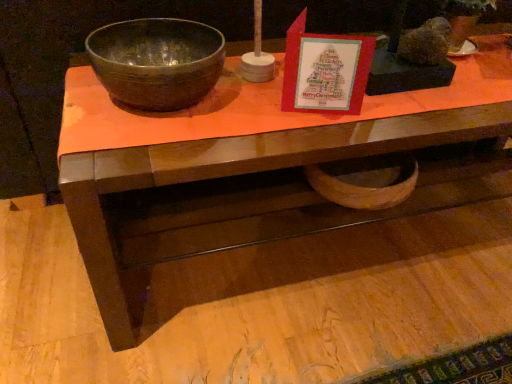
Question: Is matte brown bowl at left to the left of wooden desk at center from the viewer's perspective?

Choices:
 (A) no
 (B) yes

Answer: (B)

Question: From the image's perspective, is matte brown bowl at left under wooden desk at center?

Choices:
 (A) no
 (B) yes

Answer: (A)

Question: Is there a large distance between matte brown bowl at left and wooden desk at center?

Choices:
 (A) yes
 (B) no

Answer: (B)

Question: Considering the relative positions of matte brown bowl at left and wooden desk at center in the image provided, is matte brown bowl at left to the right of wooden desk at center from the viewer's perspective?

Choices:
 (A) yes
 (B) no

Answer: (B)

Question: Is matte brown bowl at left beside wooden desk at center?

Choices:
 (A) yes
 (B) no

Answer: (B)

Question: Is matte brown bowl at left thinner than wooden desk at center?

Choices:
 (A) yes
 (B) no

Answer: (A)

Question: Is wooden desk at center surrounding matte brown bowl at left?

Choices:
 (A) no
 (B) yes

Answer: (A)

Question: From the image's perspective, does wooden desk at center appear higher than matte brown bowl at left?

Choices:
 (A) no
 (B) yes

Answer: (A)

Question: Is wooden desk at center smaller than matte brown bowl at left?

Choices:
 (A) yes
 (B) no

Answer: (B)

Question: Would you say wooden desk at center is a long distance from matte brown bowl at left?

Choices:
 (A) no
 (B) yes

Answer: (A)

Question: Can you confirm if wooden desk at center is thinner than matte brown bowl at left?

Choices:
 (A) no
 (B) yes

Answer: (A)

Question: From the image's perspective, would you say wooden desk at center is shown under matte brown bowl at left?

Choices:
 (A) no
 (B) yes

Answer: (B)

Question: Would you say wooden desk at center is to the left or to the right of matte brown bowl at left in the picture?

Choices:
 (A) right
 (B) left

Answer: (A)